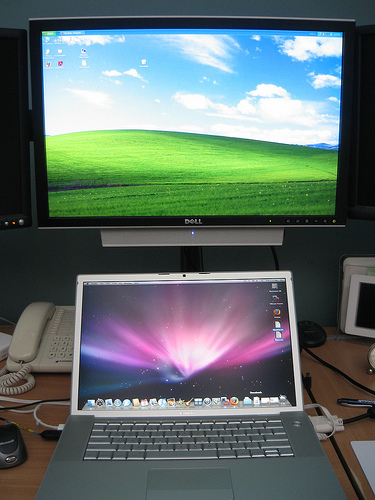
Locate an element on the screen. Image resolution: width=375 pixels, height=500 pixels. vintage telephone is located at coordinates (x=56, y=341).